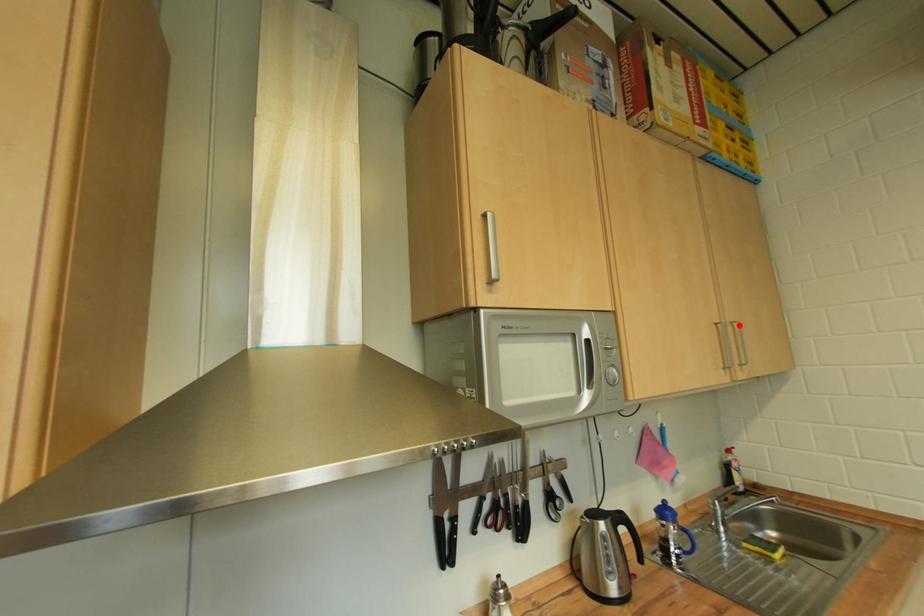
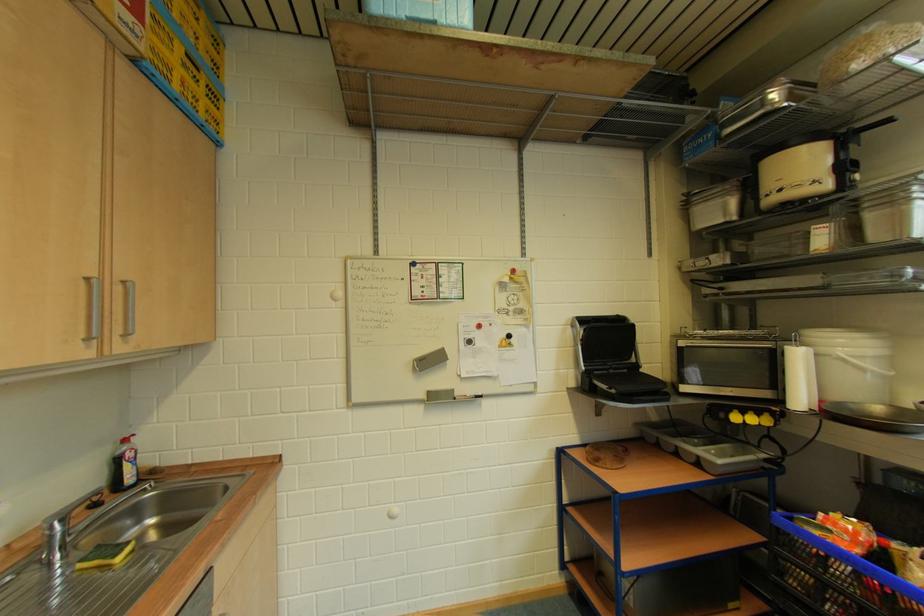
In the second image, find the point that corresponds to the highlighted location in the first image.

(130, 285)